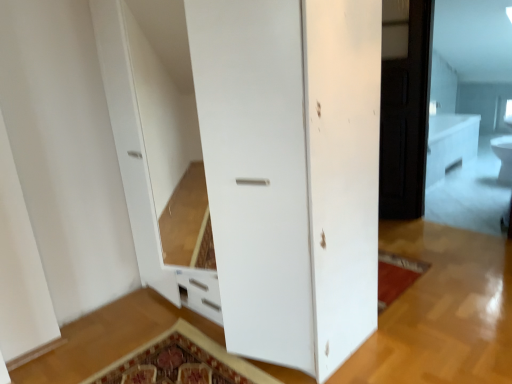
Question: Considering the relative positions of white glossy toilet bowl at upper right and dark wood screen door at right in the image provided, is white glossy toilet bowl at upper right to the right of dark wood screen door at right from the viewer's perspective?

Choices:
 (A) no
 (B) yes

Answer: (B)

Question: Can you confirm if white glossy toilet bowl at upper right is smaller than dark wood screen door at right?

Choices:
 (A) no
 (B) yes

Answer: (B)

Question: Is white glossy toilet bowl at upper right closer to camera compared to dark wood screen door at right?

Choices:
 (A) no
 (B) yes

Answer: (A)

Question: Does white glossy toilet bowl at upper right have a lesser height compared to dark wood screen door at right?

Choices:
 (A) yes
 (B) no

Answer: (A)

Question: Is dark wood screen door at right a part of white glossy toilet bowl at upper right?

Choices:
 (A) yes
 (B) no

Answer: (B)

Question: From the image's perspective, is white glossy toilet bowl at upper right located above dark wood screen door at right?

Choices:
 (A) no
 (B) yes

Answer: (A)

Question: Can you confirm if dark wood screen door at right is wider than white glossy toilet bowl at upper right?

Choices:
 (A) yes
 (B) no

Answer: (B)

Question: Is dark wood screen door at right aimed at white glossy toilet bowl at upper right?

Choices:
 (A) yes
 (B) no

Answer: (B)

Question: Would you say dark wood screen door at right contains white glossy toilet bowl at upper right?

Choices:
 (A) yes
 (B) no

Answer: (B)

Question: Is dark wood screen door at right positioned beyond the bounds of white glossy toilet bowl at upper right?

Choices:
 (A) yes
 (B) no

Answer: (A)

Question: Is dark wood screen door at right in contact with white glossy toilet bowl at upper right?

Choices:
 (A) no
 (B) yes

Answer: (A)

Question: Is dark wood screen door at right to the left of white glossy toilet bowl at upper right from the viewer's perspective?

Choices:
 (A) no
 (B) yes

Answer: (B)

Question: Considering their positions, is dark wood screen door at right located in front of or behind white glossy toilet bowl at upper right?

Choices:
 (A) behind
 (B) front

Answer: (B)